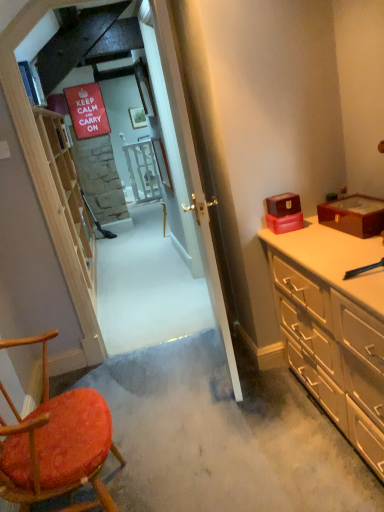
Locate an element on the screen. The height and width of the screenshot is (512, 384). spots to the right of matte red box at right, the 1th box when ordered from left to right is located at coordinates (311, 225).